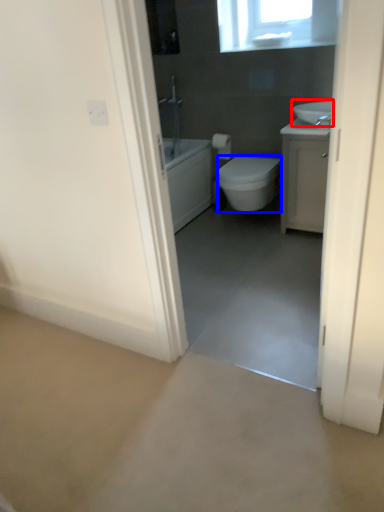
Question: Which object appears closest to the camera in this image, sink (highlighted by a red box) or bidet (highlighted by a blue box)?

Choices:
 (A) sink
 (B) bidet

Answer: (A)